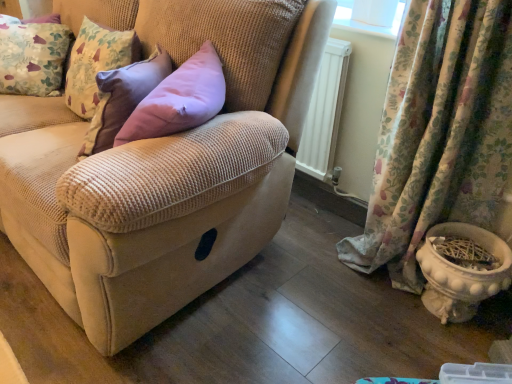
Question: In terms of height, does white glossy flowerpot at lower right look taller or shorter compared to beige corduroy couch at center?

Choices:
 (A) tall
 (B) short

Answer: (B)

Question: Is white glossy flowerpot at lower right inside or outside of beige corduroy couch at center?

Choices:
 (A) inside
 (B) outside

Answer: (B)

Question: Considering the real-world distances, which object is closest to the beige corduroy couch at center?

Choices:
 (A) floral fabric cushion at upper left
 (B) floral fabric curtain at lower right
 (C) white glossy flowerpot at lower right

Answer: (B)

Question: Which object is the closest to the white glossy flowerpot at lower right?

Choices:
 (A) beige corduroy couch at center
 (B) floral fabric cushion at upper left
 (C) floral fabric curtain at lower right

Answer: (C)